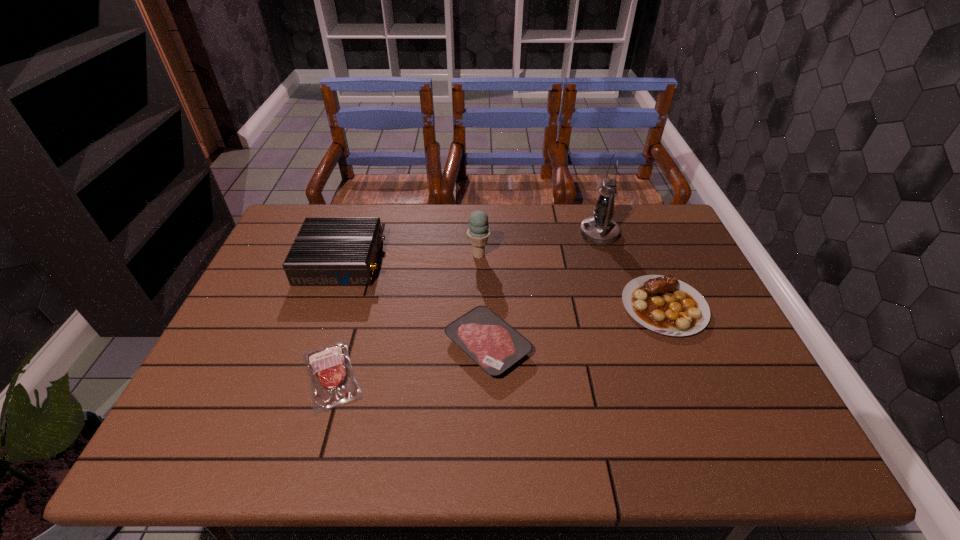
Image resolution: width=960 pixels, height=540 pixels. Identify the location of free location that satisfies the following two spatial constraints: 1. on the back panel of the shortest object; 2. on the right side of the third tallest object. (301, 375).

Identify the location of vacant space that satisfies the following two spatial constraints: 1. on the back side of the tallest object; 2. on the left side of the fifth tallest object. (486, 233).

Where is `free point that satisfies the following two spatial constraints: 1. on the back side of the second steak from right to left; 2. on the back panel of the third tallest object`? This screenshot has height=540, width=960. free point that satisfies the following two spatial constraints: 1. on the back side of the second steak from right to left; 2. on the back panel of the third tallest object is located at coordinates (487, 261).

Locate an element on the screen. The image size is (960, 540). vacant area that satisfies the following two spatial constraints: 1. on the back panel of the router; 2. on the left side of the leftmost steak is located at coordinates (301, 375).